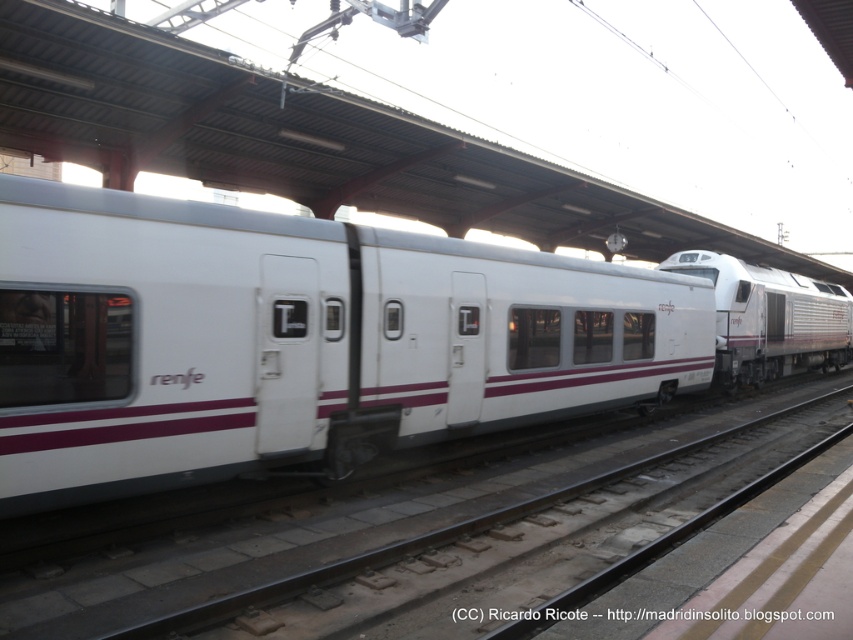
Question: Does white glossy train car at center have a lesser width compared to white metal track at center?

Choices:
 (A) yes
 (B) no

Answer: (A)

Question: Does white glossy train car at center have a smaller size compared to white metal track at center?

Choices:
 (A) no
 (B) yes

Answer: (A)

Question: Which of the following is the farthest from the observer?

Choices:
 (A) white metal track at center
 (B) white glossy train car at center
 (C) white glossy train at center

Answer: (C)

Question: Among these objects, which one is farthest from the camera?

Choices:
 (A) white glossy train car at center
 (B) white metal track at center
 (C) white glossy train at center

Answer: (C)

Question: Which point is closer to the camera taking this photo?

Choices:
 (A) (666, 440)
 (B) (450, 304)
 (C) (738, 260)

Answer: (B)

Question: Can you confirm if white metal track at center is wider than white glossy train at center?

Choices:
 (A) yes
 (B) no

Answer: (B)